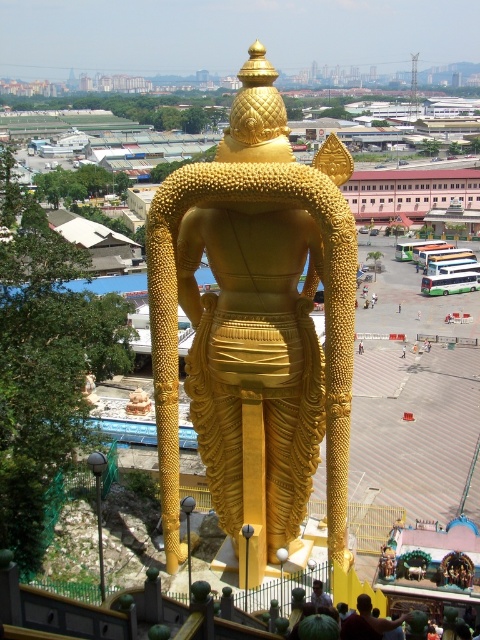
Question: Does gold polished statue at center appear on the left side of light brown wooden chair at center?

Choices:
 (A) no
 (B) yes

Answer: (B)

Question: Which of these objects is positioned farthest from the light brown wooden chair at center?

Choices:
 (A) dark brown skin at lower center
 (B) gold polished statue at center

Answer: (B)

Question: Is dark brown skin at lower center smaller than light brown wooden chair at center?

Choices:
 (A) no
 (B) yes

Answer: (A)

Question: Considering the relative positions of dark brown skin at lower center and light brown wooden chair at center in the image provided, where is dark brown skin at lower center located with respect to light brown wooden chair at center?

Choices:
 (A) below
 (B) above

Answer: (A)

Question: Which object appears farthest from the camera in this image?

Choices:
 (A) light brown wooden chair at center
 (B) gold polished statue at center
 (C) dark brown skin at lower center

Answer: (A)

Question: Which point is farther from the camera taking this photo?

Choices:
 (A) (360, 609)
 (B) (316, 372)
 (C) (316, 580)

Answer: (B)